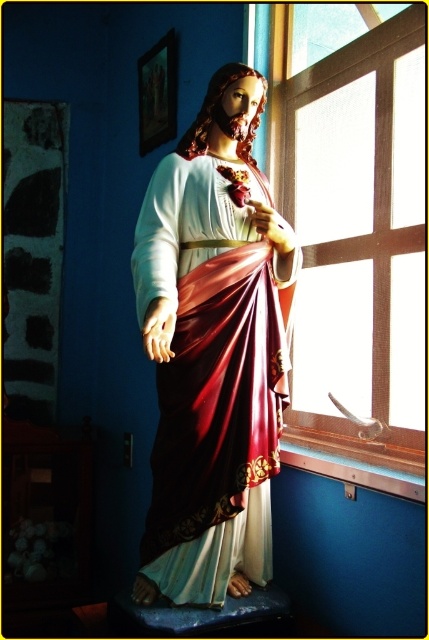
Is matte gold statue at center positioned in front of clear glass window at center?

Yes, matte gold statue at center is in front of clear glass window at center.

Which is more to the right, matte gold statue at center or clear glass window at center?

clear glass window at center is more to the right.

Who is more forward, [232,497] or [283,182]?

Point [232,497]

Identify the location of matte gold statue at center. (214, 349).